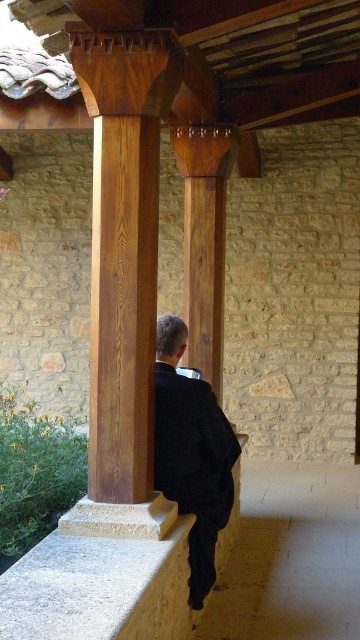
Can you confirm if smooth polished wood column at center is thinner than black matte suit at center?

In fact, smooth polished wood column at center might be wider than black matte suit at center.

Does smooth polished wood column at center have a smaller size compared to black matte suit at center?

Correct, smooth polished wood column at center occupies less space than black matte suit at center.

What do you see at coordinates (123, 246) in the screenshot? I see `smooth polished wood column at center` at bounding box center [123, 246].

At what (x,y) coordinates should I click in order to perform the action: click on smooth polished wood column at center. Please return your answer as a coordinate pair (x, y). The width and height of the screenshot is (360, 640). Looking at the image, I should click on (123, 246).

Between point (136, 548) and point (221, 243), which one is positioned in front?

Point (136, 548) is in front.

Between point (156, 570) and point (195, 340), which one is positioned behind?

Point (195, 340)

The width and height of the screenshot is (360, 640). I want to click on smooth concrete ledge at lower center, so click(102, 577).

Measure the distance between smooth polished wood column at center and camera.

9.00 feet

Who is shorter, smooth polished wood column at center or smooth concrete ledge at lower center?

Standing shorter between the two is smooth concrete ledge at lower center.

Is point (156, 150) positioned behind point (30, 632)?

Yes, point (156, 150) is farther from viewer.

In order to click on smooth polished wood column at center in this screenshot , I will do `click(123, 246)`.